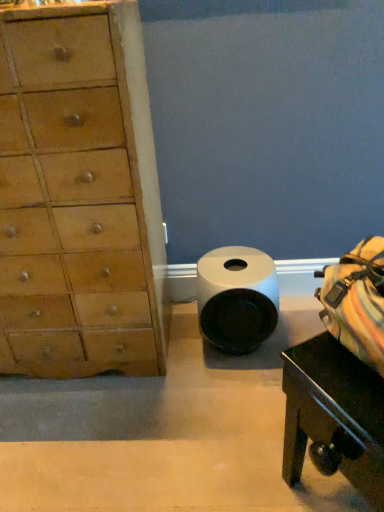
Question: Is light brown wood chest of drawers at left positioned before white matte toilet paper at center?

Choices:
 (A) no
 (B) yes

Answer: (B)

Question: Considering the relative sizes of light brown wood chest of drawers at left and white matte toilet paper at center in the image provided, is light brown wood chest of drawers at left thinner than white matte toilet paper at center?

Choices:
 (A) yes
 (B) no

Answer: (B)

Question: From the image's perspective, would you say light brown wood chest of drawers at left is shown under white matte toilet paper at center?

Choices:
 (A) yes
 (B) no

Answer: (B)

Question: Is light brown wood chest of drawers at left outside white matte toilet paper at center?

Choices:
 (A) yes
 (B) no

Answer: (A)

Question: From a real-world perspective, is light brown wood chest of drawers at left physically below white matte toilet paper at center?

Choices:
 (A) no
 (B) yes

Answer: (A)

Question: Is white matte toilet paper at center in front of or behind black glossy table at lower right in the image?

Choices:
 (A) behind
 (B) front

Answer: (A)

Question: Is white matte toilet paper at center inside the boundaries of black glossy table at lower right, or outside?

Choices:
 (A) outside
 (B) inside

Answer: (A)

Question: Considering the relative positions of white matte toilet paper at center and black glossy table at lower right in the image provided, is white matte toilet paper at center to the left or to the right of black glossy table at lower right?

Choices:
 (A) left
 (B) right

Answer: (A)

Question: Is point (236, 281) closer or farther from the camera than point (347, 389)?

Choices:
 (A) closer
 (B) farther

Answer: (B)

Question: Is point (243, 314) positioned closer to the camera than point (86, 303)?

Choices:
 (A) closer
 (B) farther

Answer: (B)

Question: Visually, is white matte toilet paper at center positioned to the left or to the right of light brown wood chest of drawers at left?

Choices:
 (A) right
 (B) left

Answer: (A)

Question: From a real-world perspective, is white matte toilet paper at center positioned above or below light brown wood chest of drawers at left?

Choices:
 (A) above
 (B) below

Answer: (B)

Question: From their relative heights in the image, would you say white matte toilet paper at center is taller or shorter than light brown wood chest of drawers at left?

Choices:
 (A) short
 (B) tall

Answer: (A)

Question: Which is correct: light brown wood chest of drawers at left is inside black glossy table at lower right, or outside of it?

Choices:
 (A) inside
 (B) outside

Answer: (B)

Question: From the image's perspective, relative to black glossy table at lower right, is light brown wood chest of drawers at left above or below?

Choices:
 (A) above
 (B) below

Answer: (A)